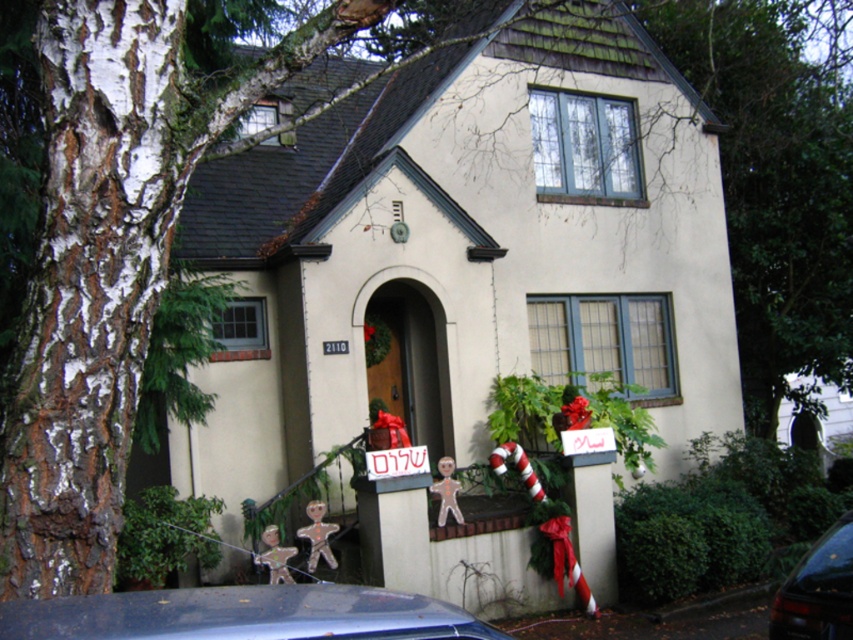
The width and height of the screenshot is (853, 640). Identify the location of metallic blue car at lower left. (244, 614).

Where is `metallic blue car at lower left`? This screenshot has width=853, height=640. metallic blue car at lower left is located at coordinates (244, 614).